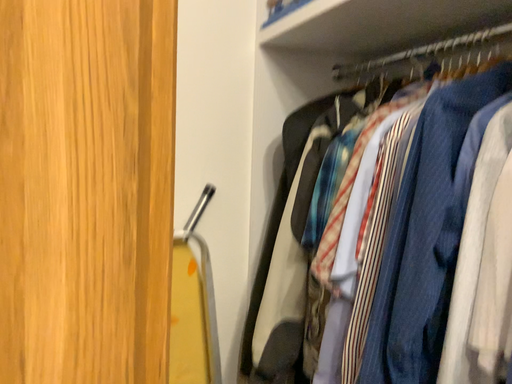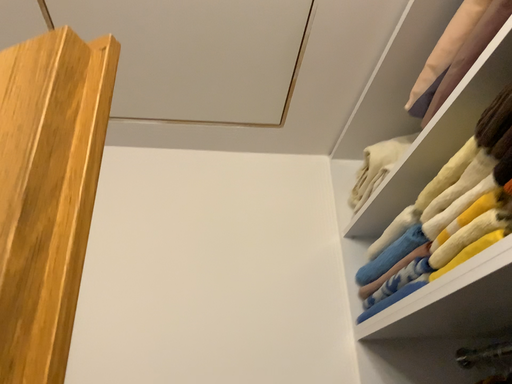
Question: How did the camera likely rotate when shooting the video?

Choices:
 (A) rotated downward
 (B) rotated upward

Answer: (B)